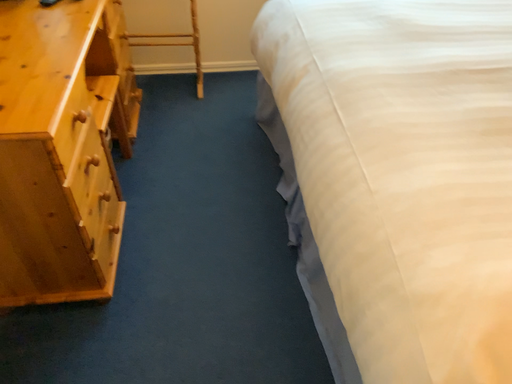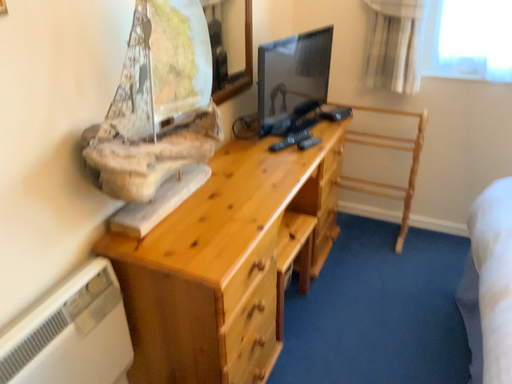
Question: Which way did the camera rotate in the video?

Choices:
 (A) rotated right
 (B) rotated left

Answer: (B)